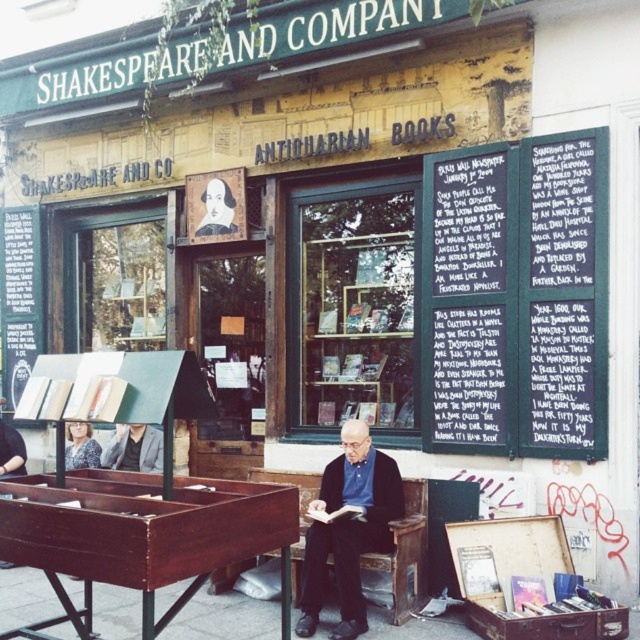
You are a customer standing outside the bookstore and want to read the black chalkboard at upper center and the dark blue shirt at center. Which object is wider?

The black chalkboard at upper center is wider than the dark blue shirt at center.

You are a customer standing outside the bookstore and want to read the black chalkboard at upper center. However, there is a dark blue shirt at center in the way. Can you see the chalkboard clearly from your current position?

The black chalkboard at upper center is positioned over the dark blue shirt at center, so the shirt is blocking your view of the chalkboard. You will need to move to a different angle to see it clearly.